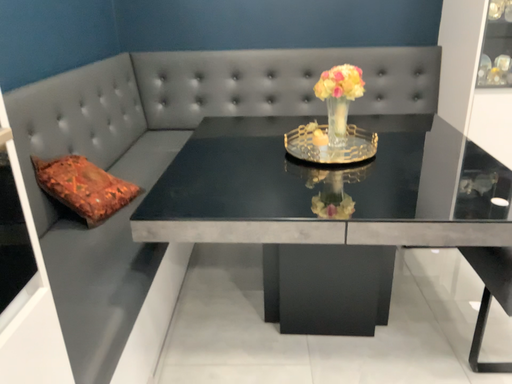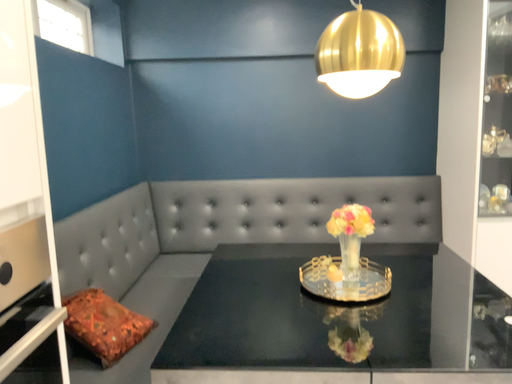
Question: How did the camera likely rotate when shooting the video?

Choices:
 (A) rotated upward
 (B) rotated downward

Answer: (A)